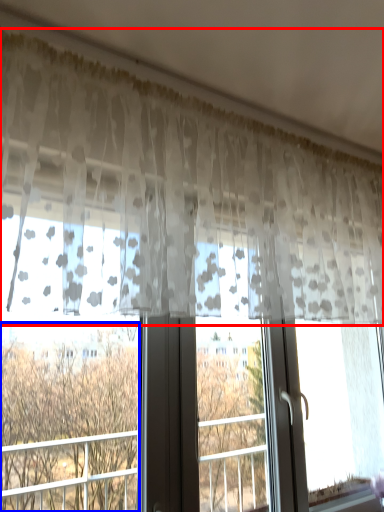
Question: Which object is closer to the camera taking this photo, curtain (highlighted by a red box) or tree (highlighted by a blue box)?

Choices:
 (A) curtain
 (B) tree

Answer: (A)